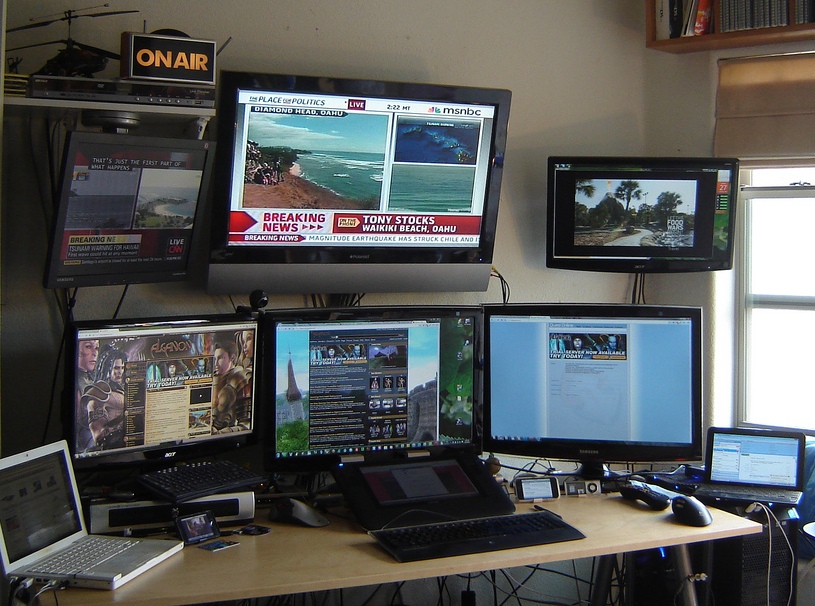
I want to click on on air sign, so click(x=183, y=58).